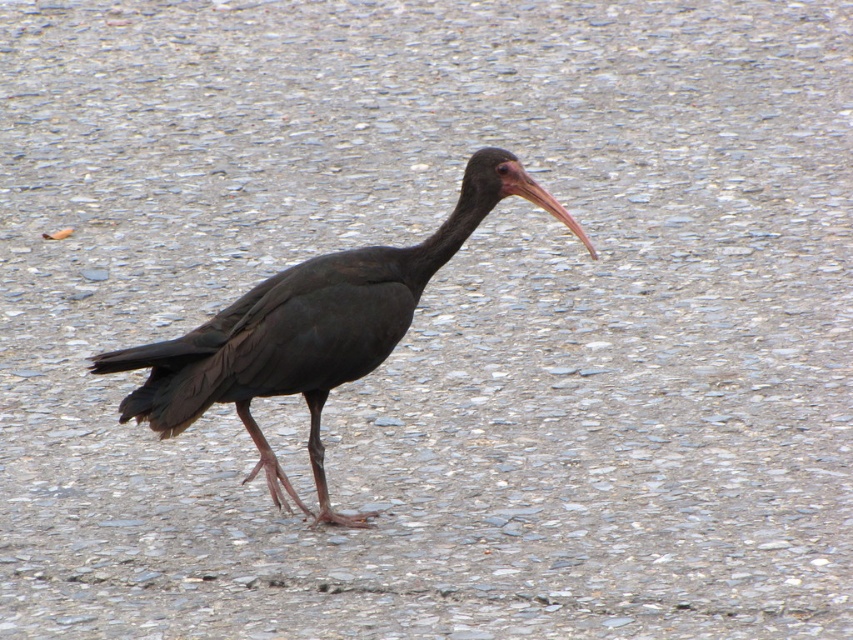
Can you confirm if shiny black bird at center is shorter than matte pink beak at center?

In fact, shiny black bird at center may be taller than matte pink beak at center.

Can you confirm if shiny black bird at center is thinner than matte pink beak at center?

In fact, shiny black bird at center might be wider than matte pink beak at center.

Which is in front, point (392, 321) or point (584, 237)?

Positioned in front is point (584, 237).

The height and width of the screenshot is (640, 853). What are the coordinates of `shiny black bird at center` in the screenshot? It's located at [303, 336].